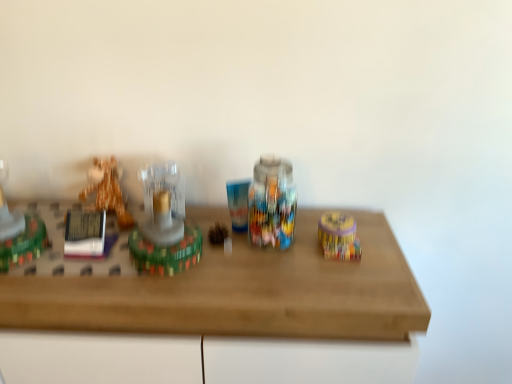
In order to click on vacant space behind matte yellow container at right, which ranks as the 4th toy in left-to-right order in this screenshot , I will do `click(334, 212)`.